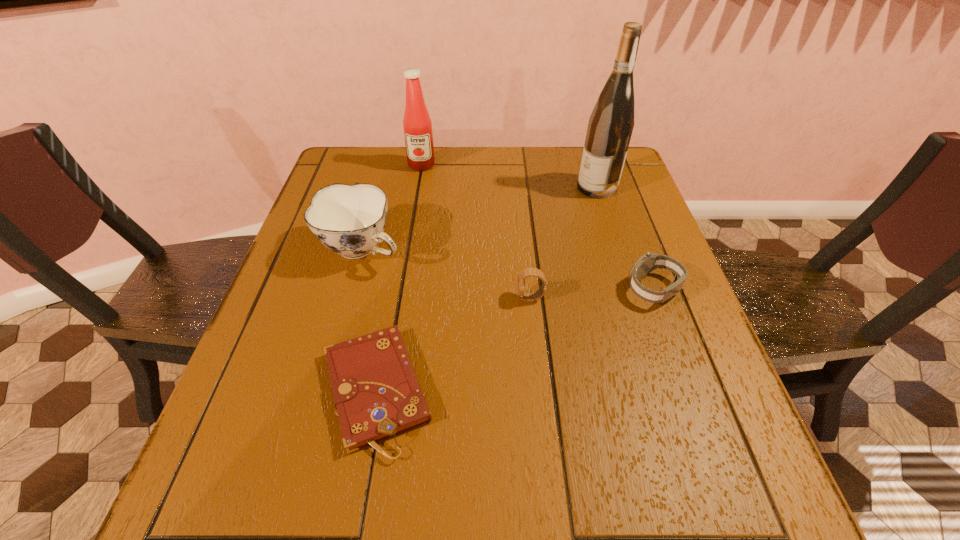
The height and width of the screenshot is (540, 960). In order to click on free point between the fourth object from left to right and the right watch in this screenshot , I will do `click(592, 294)`.

Select which object is the fifth closest to the nearest object. Please provide its 2D coordinates. Your answer should be formatted as a tuple, i.e. [(x, y)], where the tuple contains the x and y coordinates of a point satisfying the conditions above.

[(417, 124)]

Locate an element on the screen. the closest object to the left watch is located at coordinates (376, 393).

You are a GUI agent. You are given a task and a screenshot of the screen. Output one action in this format:
    pyautogui.click(x=<x>, y=<y>)
    Task: Click on the vacant space that satisfies the following two spatial constraints: 1. on the front-facing side of the farthest object; 2. on the left side of the tallest object
    
    Given the screenshot: What is the action you would take?
    pyautogui.click(x=418, y=187)

Find the location of `free space that satisfies the following two spatial constraints: 1. on the front-facing side of the fifth shortest object; 2. on the left side of the tallest object`. free space that satisfies the following two spatial constraints: 1. on the front-facing side of the fifth shortest object; 2. on the left side of the tallest object is located at coordinates (418, 187).

Identify the location of vacant area that satisfies the following two spatial constraints: 1. on the face of the left watch; 2. on the front side of the notebook. This screenshot has width=960, height=540. (540, 390).

What are the coordinates of `vacant space that satisfies the following two spatial constraints: 1. on the front-facing side of the wine bottle; 2. on the left side of the condiment` in the screenshot? It's located at (418, 187).